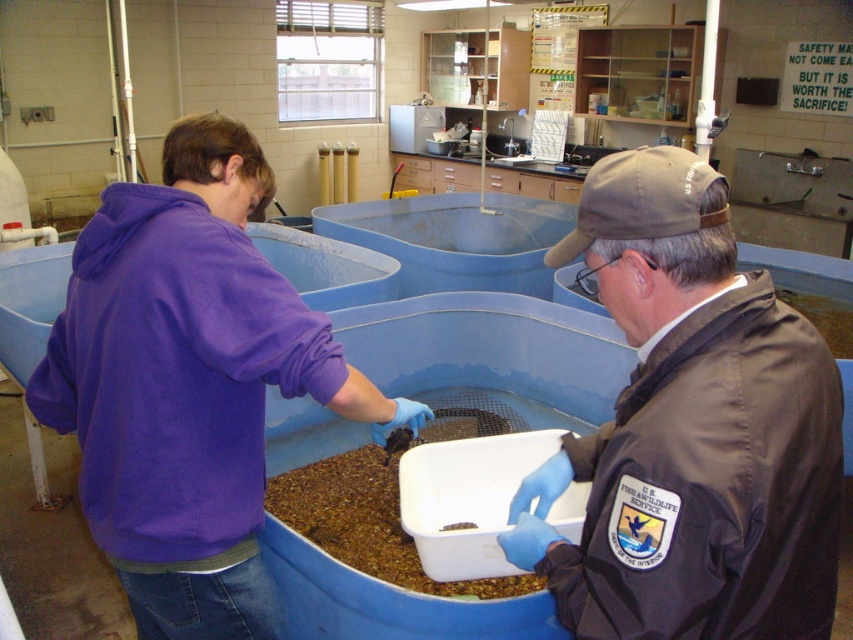
You are a researcher in the lab who needs to grab a tool from the shelf. The tool is placed exactly between the brown leather jacket at center and the purple fleece jacket at center. Can you reach the tool without moving either jacket?

The brown leather jacket at center and purple fleece jacket at center are 23.13 inches apart. Since the tool is placed exactly between them, the distance from each jacket to the tool is about 11.56 inches. If you can reach within that distance from either jacket, you can grab the tool without moving them.

Looking at this image, you are navigating a small drone through the laboratory. There are two points marked as point 1 at coordinates (564, 572) and point 2 at (196, 586). To reach point 1 before point 2, which direction should you fly the drone first?

To reach point 1 at coordinates (564, 572) before point 2 at (196, 586), you should fly the drone upwards first since point 1 is positioned above point 2.